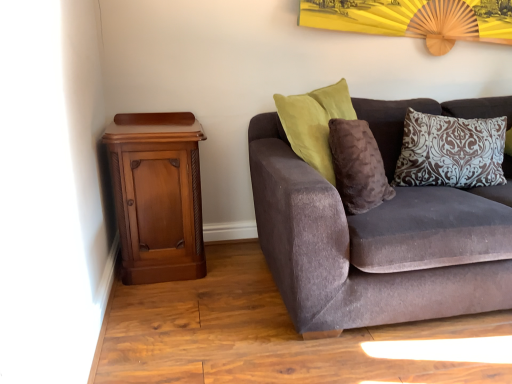
Question: Should I look upward or downward to see polished wood nightstand at left?

Choices:
 (A) down
 (B) up

Answer: (A)

Question: Considering the relative sizes of velvet brown couch at right and polished wood nightstand at left in the image provided, is velvet brown couch at right bigger than polished wood nightstand at left?

Choices:
 (A) yes
 (B) no

Answer: (A)

Question: Is velvet brown couch at right outside polished wood nightstand at left?

Choices:
 (A) yes
 (B) no

Answer: (A)

Question: Is velvet brown couch at right aimed at polished wood nightstand at left?

Choices:
 (A) yes
 (B) no

Answer: (B)

Question: Is velvet brown couch at right turned away from polished wood nightstand at left?

Choices:
 (A) yes
 (B) no

Answer: (B)

Question: Is velvet brown couch at right to the right of polished wood nightstand at left from the viewer's perspective?

Choices:
 (A) yes
 (B) no

Answer: (A)

Question: Can you confirm if velvet brown couch at right is taller than polished wood nightstand at left?

Choices:
 (A) no
 (B) yes

Answer: (B)

Question: From a real-world perspective, is polished wood nightstand at left beneath brown damask pillow at upper right?

Choices:
 (A) no
 (B) yes

Answer: (B)

Question: Does polished wood nightstand at left contain brown damask pillow at upper right?

Choices:
 (A) no
 (B) yes

Answer: (A)

Question: Is polished wood nightstand at left not within brown damask pillow at upper right?

Choices:
 (A) yes
 (B) no

Answer: (A)

Question: From the image's perspective, would you say polished wood nightstand at left is shown under brown damask pillow at upper right?

Choices:
 (A) no
 (B) yes

Answer: (B)

Question: Would you consider polished wood nightstand at left to be distant from brown damask pillow at upper right?

Choices:
 (A) yes
 (B) no

Answer: (A)

Question: Is polished wood nightstand at left looking in the opposite direction of brown damask pillow at upper right?

Choices:
 (A) yes
 (B) no

Answer: (B)

Question: Is velvet brown couch at right surrounded by polished wood nightstand at left?

Choices:
 (A) no
 (B) yes

Answer: (A)